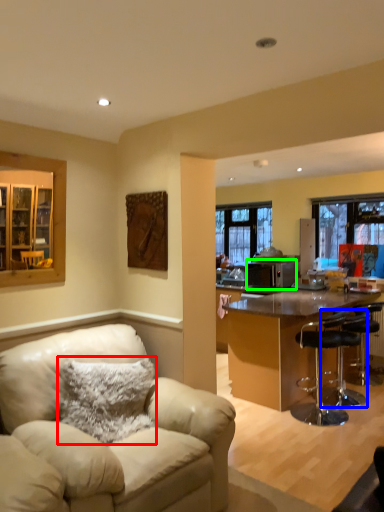
Question: Estimate the real-world distances between objects in this image. Which object is farther from pillow (highlighted by a red box), chair (highlighted by a blue box) or appliance (highlighted by a green box)?

Choices:
 (A) chair
 (B) appliance

Answer: (B)